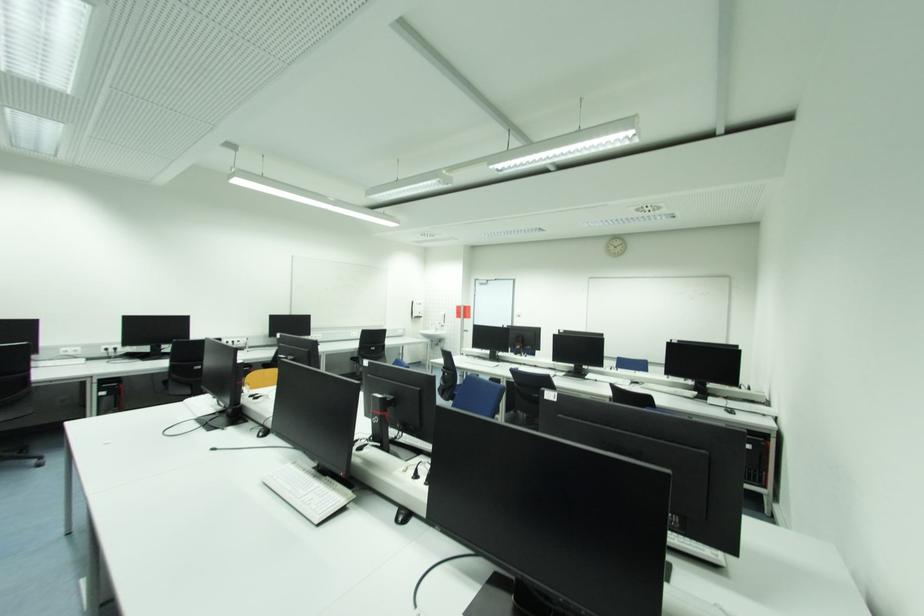
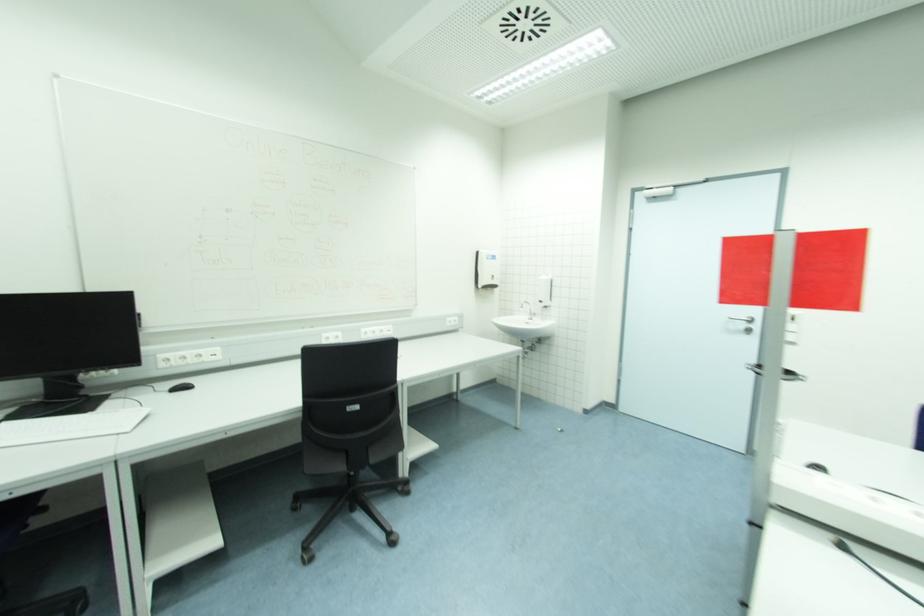
The point at (443, 325) is marked in the first image. Where is the corresponding point in the second image?

(543, 302)